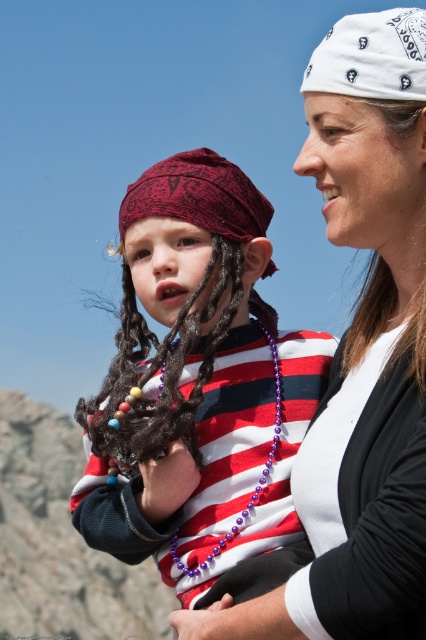
Does matte red bandana at center appear on the right side of dark brown dreadlocks at center?

Correct, you'll find matte red bandana at center to the right of dark brown dreadlocks at center.

Which is in front, point (74, 516) or point (175, 433)?

Point (175, 433) is more forward.

Where is `matte red bandana at center`? Image resolution: width=426 pixels, height=640 pixels. matte red bandana at center is located at coordinates (199, 392).

Can you confirm if white matte bandana at upper right is wider than dark brown dreadlocks at center?

Correct, the width of white matte bandana at upper right exceeds that of dark brown dreadlocks at center.

Does point (403, 481) come in front of point (134, 371)?

Yes, it is in front of point (134, 371).

The height and width of the screenshot is (640, 426). What are the coordinates of `white matte bandana at upper right` in the screenshot? It's located at (360, 355).

Does white matte bandana at upper right have a smaller size compared to white bandana at upper right?

Actually, white matte bandana at upper right might be larger than white bandana at upper right.

Where is `white matte bandana at upper right`? white matte bandana at upper right is located at coordinates (360, 355).

Locate an element on the screen. white matte bandana at upper right is located at coordinates (360, 355).